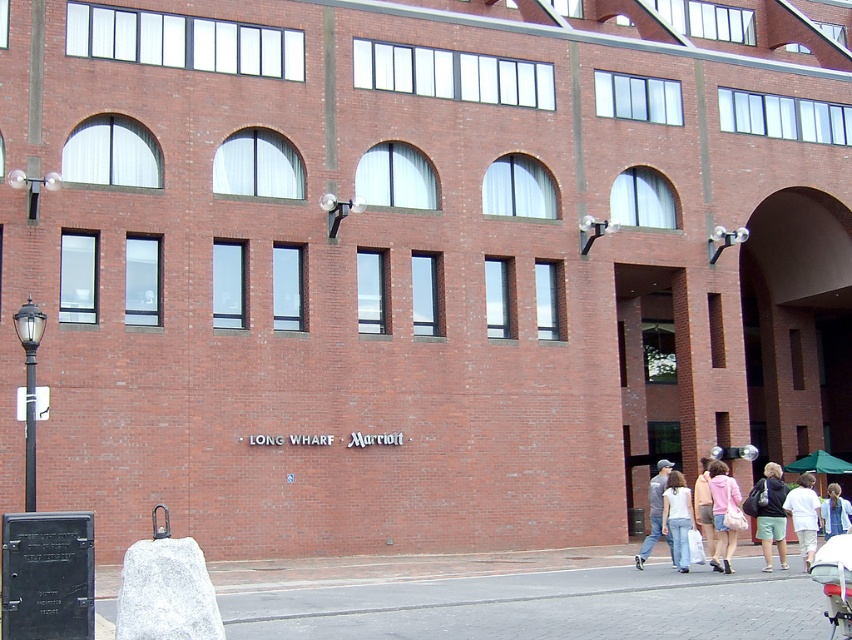
You are a fashion designer observing the exterior of the LONG WHARF Marriott building. You notice a light pink fabric jacket at lower right and a white cotton shirt at center. Which clothing item is smaller in size?

The light pink fabric jacket at lower right has a smaller size compared to the white cotton shirt at center.

You are standing in front of the LONG WHARF Marriott building and notice two items at the lower right corner of the image. Which one is closer to you between the light pink fabric jacket at lower right and the green shorts at lower right?

The green shorts at lower right is closer to you because the light pink fabric jacket at lower right is behind it.

You are a photographer setting up a shot of the building. You need to ensure that the black polished metal streetlamp at left doesn not block the view of the white cotton shirt at center. Given their widths, can the streetlamp be positioned to the side without overlapping the shirt in the frame?

The black polished metal streetlamp at left is narrower than the white cotton shirt at center, so it can be positioned to the side without overlapping the shirt in the frame.